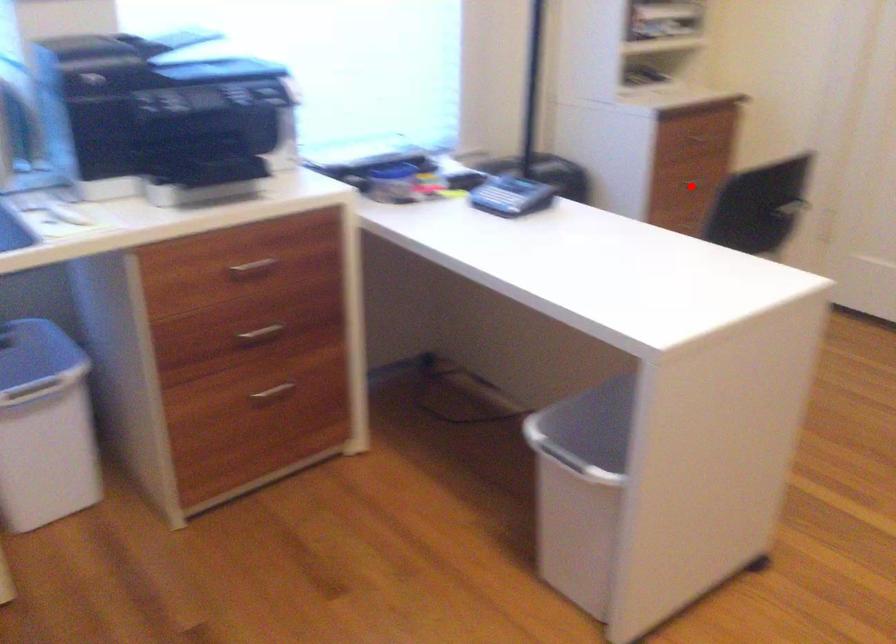
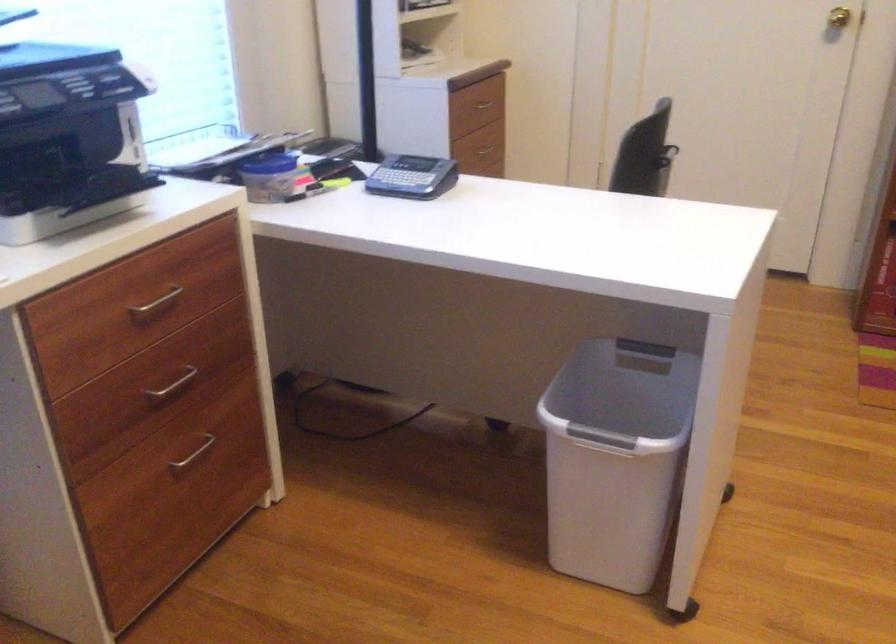
Question: I am providing you with two images of the same scene from different viewpoints. A red point is marked on the first image. Is the red point's position out of view in image 2?

Choices:
 (A) Yes
 (B) No

Answer: (B)